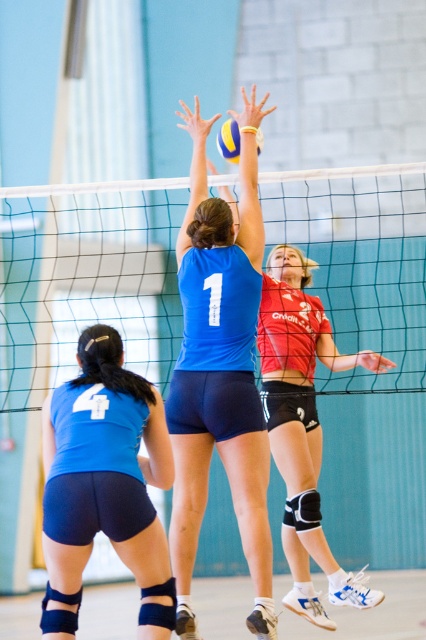
Who is lower down, white mesh net at center or red jersey at upper center?

red jersey at upper center

Between point (132, 305) and point (299, 426), which one is positioned in front?

Point (299, 426) is in front.

Find the location of `white mesh net at center`. white mesh net at center is located at coordinates (86, 278).

Based on the photo, which is below, matte blue shorts at lower left or red jersey at upper center?

matte blue shorts at lower left

Between point (100, 492) and point (322, 435), which one is positioned behind?

Positioned behind is point (322, 435).

Does point (109, 352) lie behind point (281, 417)?

No, it is in front of (281, 417).

This screenshot has height=640, width=426. In order to click on matte blue shorts at lower left in this screenshot , I will do `click(104, 483)`.

Is point (161, 388) farther from camera compared to point (232, 132)?

Yes, it is.

Who is more distant from viewer, (x=397, y=209) or (x=224, y=129)?

Point (x=397, y=209)

Locate an element on the screen. This screenshot has height=640, width=426. white mesh net at center is located at coordinates (86, 278).